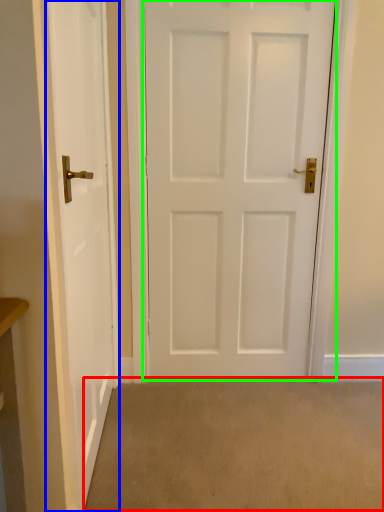
Question: Considering the real-world distances, which object is closest to plain (highlighted by a red box)? door (highlighted by a blue box) or door (highlighted by a green box).

Choices:
 (A) door
 (B) door

Answer: (A)